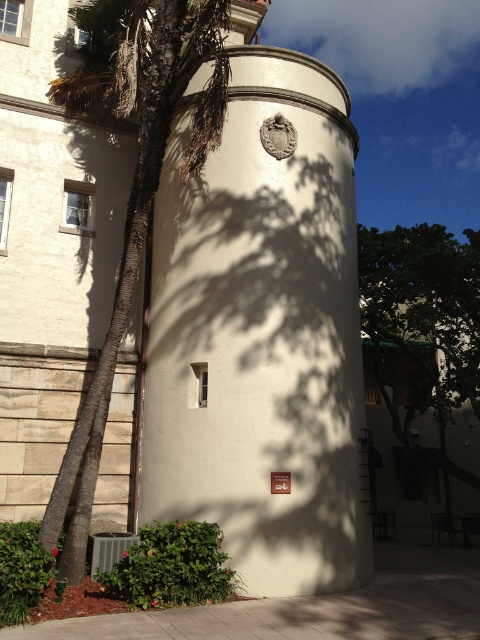
Is green leafy palm tree at left further to the viewer compared to green leafy tree at center?

No, green leafy palm tree at left is in front of green leafy tree at center.

Who is higher up, green leafy palm tree at left or green leafy tree at center?

green leafy palm tree at left is higher up.

Which is behind, point (152, 118) or point (380, 364)?

The point (380, 364) is behind.

This screenshot has height=640, width=480. I want to click on green leafy palm tree at left, so click(x=132, y=184).

Who is positioned more to the right, white smooth bell tower at center or green leafy tree at center?

From the viewer's perspective, green leafy tree at center appears more on the right side.

Which is more to the left, white smooth bell tower at center or green leafy tree at center?

white smooth bell tower at center is more to the left.

Image resolution: width=480 pixels, height=640 pixels. In order to click on white smooth bell tower at center in this screenshot , I will do `click(262, 333)`.

Who is taller, white smooth bell tower at center or green leafy palm tree at left?

Standing taller between the two is green leafy palm tree at left.

From the picture: Between white smooth bell tower at center and green leafy palm tree at left, which one is positioned lower?

white smooth bell tower at center

The width and height of the screenshot is (480, 640). What are the coordinates of `white smooth bell tower at center` in the screenshot? It's located at (262, 333).